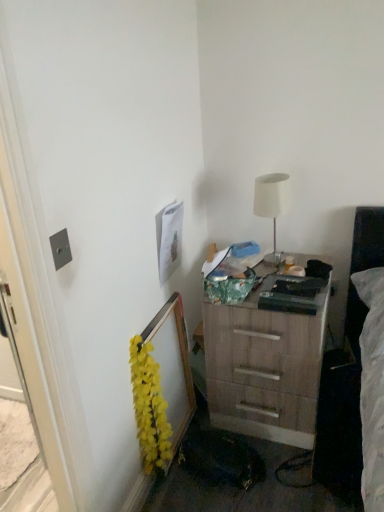
Question: Is yellow artificial flowers at left completely or partially outside of wooden chest of drawers at lower right?

Choices:
 (A) no
 (B) yes

Answer: (B)

Question: Is yellow artificial flowers at left smaller than wooden chest of drawers at lower right?

Choices:
 (A) yes
 (B) no

Answer: (A)

Question: From the image's perspective, is yellow artificial flowers at left below wooden chest of drawers at lower right?

Choices:
 (A) no
 (B) yes

Answer: (B)

Question: From a real-world perspective, is yellow artificial flowers at left on wooden chest of drawers at lower right?

Choices:
 (A) yes
 (B) no

Answer: (A)

Question: Is yellow artificial flowers at left surrounding wooden chest of drawers at lower right?

Choices:
 (A) yes
 (B) no

Answer: (B)

Question: Does yellow artificial flowers at left have a greater height compared to wooden chest of drawers at lower right?

Choices:
 (A) yes
 (B) no

Answer: (B)

Question: Considering the relative positions of white matte table lamp at upper right and yellow artificial flowers at left in the image provided, is white matte table lamp at upper right to the left of yellow artificial flowers at left from the viewer's perspective?

Choices:
 (A) yes
 (B) no

Answer: (B)

Question: From the image's perspective, does white matte table lamp at upper right appear lower than yellow artificial flowers at left?

Choices:
 (A) no
 (B) yes

Answer: (A)

Question: Is white matte table lamp at upper right thinner than yellow artificial flowers at left?

Choices:
 (A) yes
 (B) no

Answer: (B)

Question: From a real-world perspective, is white matte table lamp at upper right on yellow artificial flowers at left?

Choices:
 (A) yes
 (B) no

Answer: (A)

Question: Is white matte table lamp at upper right at the right side of yellow artificial flowers at left?

Choices:
 (A) no
 (B) yes

Answer: (B)

Question: From the image's perspective, would you say white matte table lamp at upper right is positioned over yellow artificial flowers at left?

Choices:
 (A) yes
 (B) no

Answer: (A)

Question: Is metallic silver outlet at left in front of white matte table lamp at upper right?

Choices:
 (A) no
 (B) yes

Answer: (B)